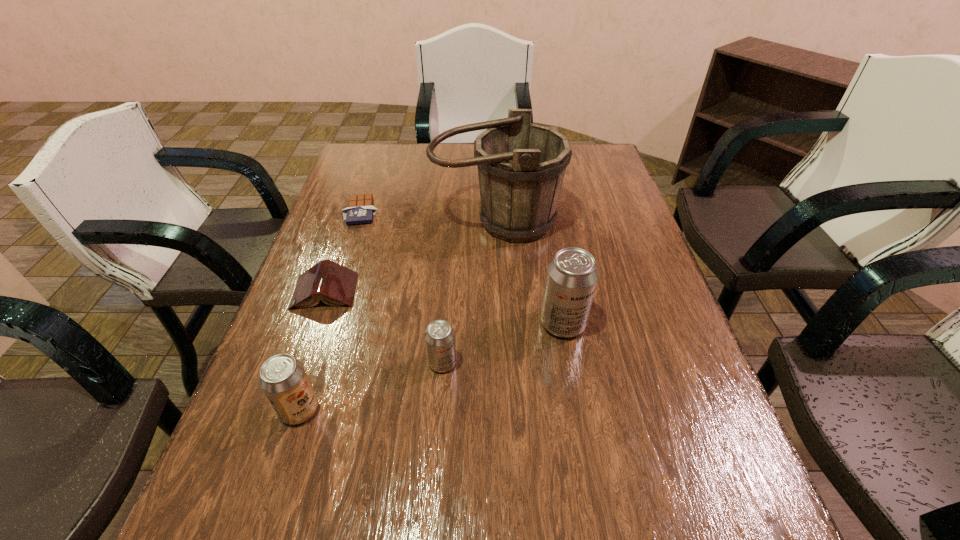
Locate an element on the screen. The image size is (960, 540). vacant space situated on the right of the second farthest beer can is located at coordinates (641, 363).

At what (x,y) coordinates should I click in order to perform the action: click on vacant space located on the left of the tallest beer can. Please return your answer as a coordinate pair (x, y). The image size is (960, 540). Looking at the image, I should click on (435, 323).

Where is `free location located on the right of the shortest object`? free location located on the right of the shortest object is located at coordinates coord(469,211).

At what (x,y) coordinates should I click in order to perform the action: click on free space located on the handle side of the tallest object. Please return your answer as a coordinate pair (x, y). Looking at the image, I should click on (501, 348).

You are a GUI agent. You are given a task and a screenshot of the screen. Output one action in this format:
    pyautogui.click(x=<x>, y=<y>)
    Task: Click on the vacant region located 0.270m on the front of the fifth tallest object
    Image resolution: width=960 pixels, height=540 pixels.
    Given the screenshot: What is the action you would take?
    pyautogui.click(x=281, y=416)

Find the location of `beer can present at the left edge`. beer can present at the left edge is located at coordinates (283, 379).

The width and height of the screenshot is (960, 540). What are the coordinates of `chocolate bar located in the left edge section of the desktop` in the screenshot? It's located at (360, 210).

I want to click on book that is at the left edge, so click(x=334, y=284).

Locate an element on the screen. free region at the near edge of the desktop is located at coordinates (583, 455).

This screenshot has width=960, height=540. I want to click on vacant space at the left edge, so click(321, 341).